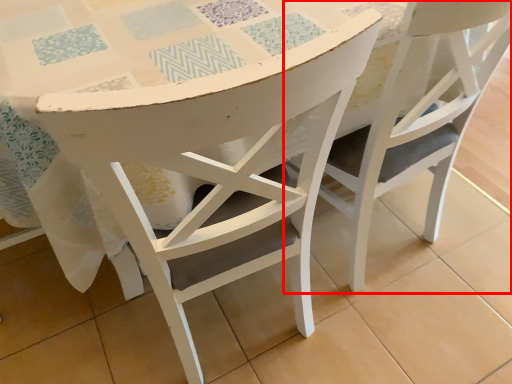
Question: From the image's perspective, where is chair (annotated by the red box) located relative to chair?

Choices:
 (A) below
 (B) above

Answer: (B)